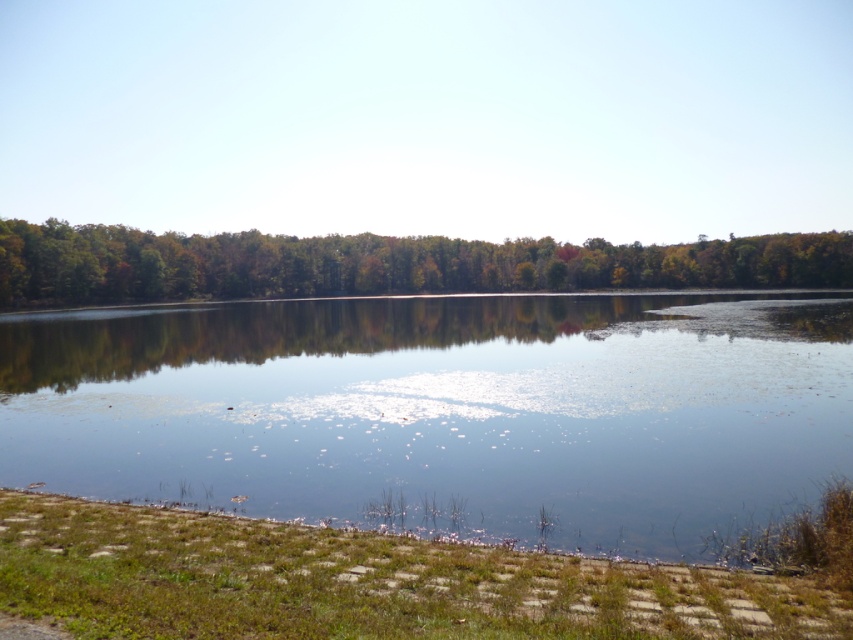
You are planning to take a photo of the clear water at center and the green matte trees at upper center. Which object will appear wider in the photo?

The green matte trees at upper center will appear wider in the photo because the clear water at center has a smaller width compared to the green matte trees at upper center.

In the scene shown: You are standing on the lakeside path and want to take a photo of the clear water at center and the green matte trees at upper center. To capture both in the frame, should you adjust your camera to the left or right?

You should adjust your camera to the left because the clear water at center is to the left of the green matte trees at upper center.